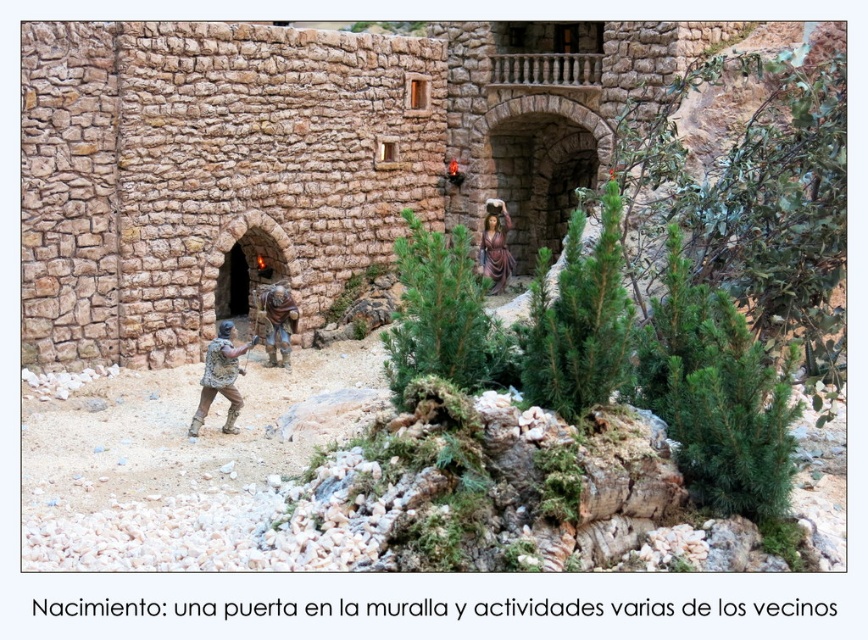
You are a knight standing in the medieval diorama scene. You see both the matte brown armor at center and the matte brown statue at center. Which object can you see the top of from your current position?

The matte brown armor at center is shorter than the matte brown statue at center, so you can see the top of the matte brown armor at center.